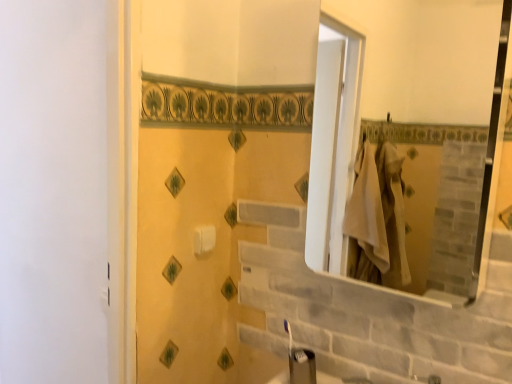
Question: Is white glossy mirror at upper right turned away from white matte toilet paper at center?

Choices:
 (A) yes
 (B) no

Answer: (B)

Question: Is white matte toilet paper at center inside white glossy mirror at upper right?

Choices:
 (A) no
 (B) yes

Answer: (A)

Question: From a real-world perspective, is white glossy mirror at upper right under white matte toilet paper at center?

Choices:
 (A) no
 (B) yes

Answer: (A)

Question: From the image's perspective, is white glossy mirror at upper right located beneath white matte toilet paper at center?

Choices:
 (A) no
 (B) yes

Answer: (A)

Question: Can you confirm if white glossy mirror at upper right is taller than white matte toilet paper at center?

Choices:
 (A) yes
 (B) no

Answer: (A)

Question: Can you see white glossy mirror at upper right touching white matte toilet paper at center?

Choices:
 (A) no
 (B) yes

Answer: (A)

Question: Is white matte toilet paper at center bigger than white glossy mirror at upper right?

Choices:
 (A) no
 (B) yes

Answer: (A)

Question: Is white matte toilet paper at center placed right next to white glossy mirror at upper right?

Choices:
 (A) yes
 (B) no

Answer: (B)

Question: Does white matte toilet paper at center come in front of white glossy mirror at upper right?

Choices:
 (A) yes
 (B) no

Answer: (B)

Question: Is white matte toilet paper at center wider than white glossy mirror at upper right?

Choices:
 (A) yes
 (B) no

Answer: (B)

Question: Does white matte toilet paper at center have a lesser width compared to white glossy mirror at upper right?

Choices:
 (A) no
 (B) yes

Answer: (B)

Question: Is white matte toilet paper at center positioned far away from white glossy mirror at upper right?

Choices:
 (A) no
 (B) yes

Answer: (B)

Question: Considering the relative positions of white glossy mirror at upper right and white matte toilet paper at center in the image provided, is white glossy mirror at upper right to the left or to the right of white matte toilet paper at center?

Choices:
 (A) right
 (B) left

Answer: (A)